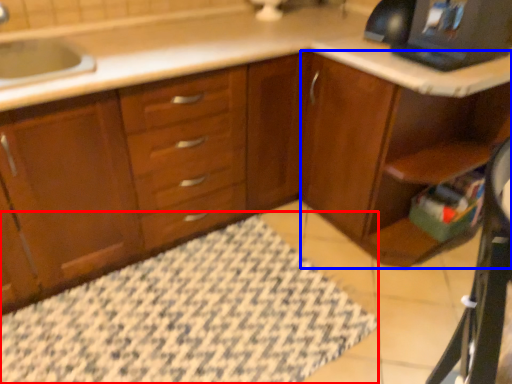
Question: Which object appears closest to the camera in this image, bath mat (highlighted by a red box) or dresser (highlighted by a blue box)?

Choices:
 (A) bath mat
 (B) dresser

Answer: (A)